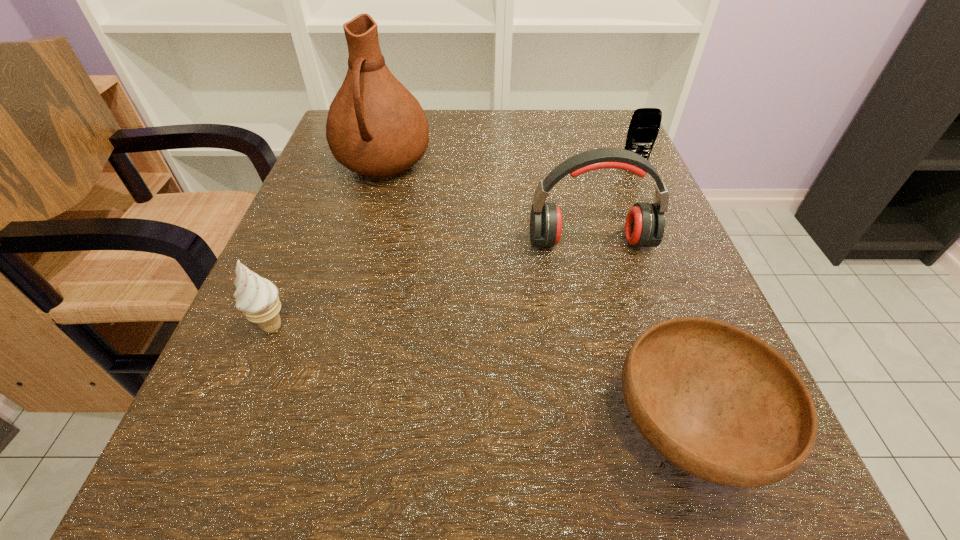
Locate an element on the screen. the tallest object is located at coordinates tap(375, 127).

Find the location of `the fourth shortest object`. the fourth shortest object is located at coordinates (645, 223).

Where is `the third farthest object`? the third farthest object is located at coordinates (645, 223).

Identify the location of icecream. (257, 297).

The image size is (960, 540). Find the location of `cellular telephone`. cellular telephone is located at coordinates (644, 126).

Identify the location of the nearest object. (716, 401).

You are a GUI agent. You are given a task and a screenshot of the screen. Output one action in this format:
    pyautogui.click(x=<x>, y=<y>)
    Task: Click on the bowl
    The image size is (960, 540).
    Given the screenshot: What is the action you would take?
    pyautogui.click(x=716, y=401)

At what (x,y) coordinates should I click in order to perform the action: click on vacant space located on the side of the tallest object with the handle. Please return your answer as a coordinate pair (x, y). This screenshot has width=960, height=540. Looking at the image, I should click on (331, 350).

In order to click on free space located 0.160m on the ear cups of the second tallest object in this screenshot , I will do `click(616, 341)`.

In order to click on vacant area situated on the front-facing side of the second nearest object in this screenshot , I will do `click(486, 326)`.